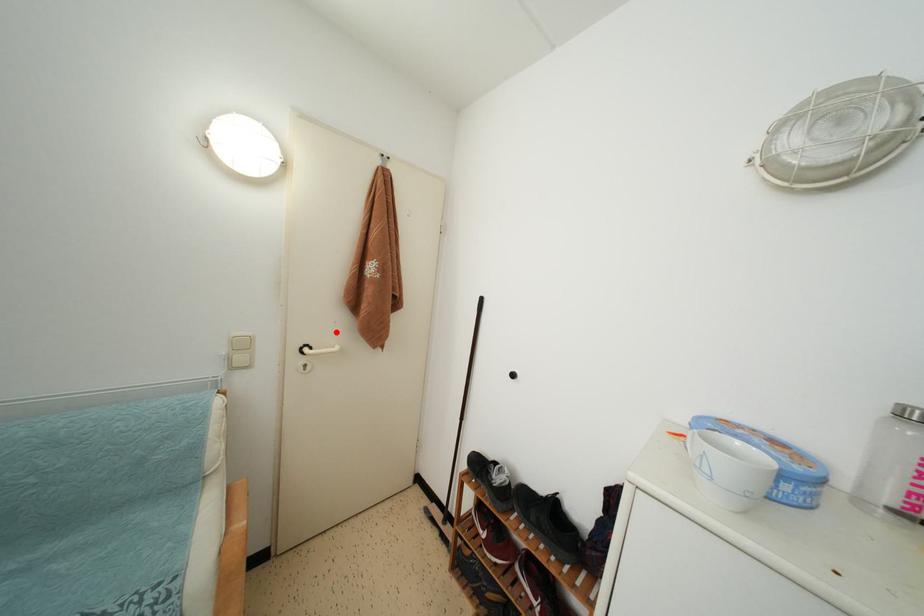
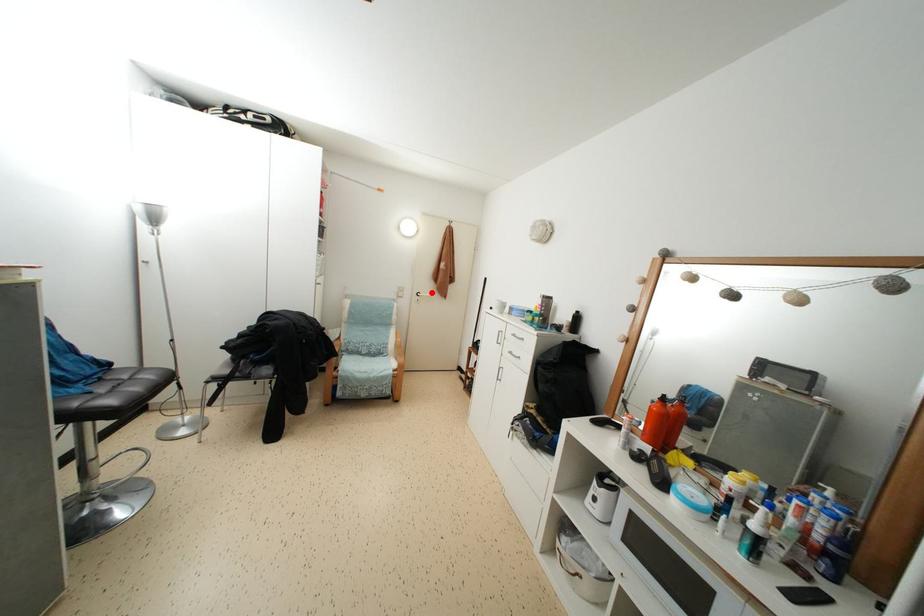
I am providing you with two images of the same scene from different viewpoints. A red point is marked on the first image and another point is marked on the second image. Is the red point in image1 aligned with the point shown in image2?

Yes